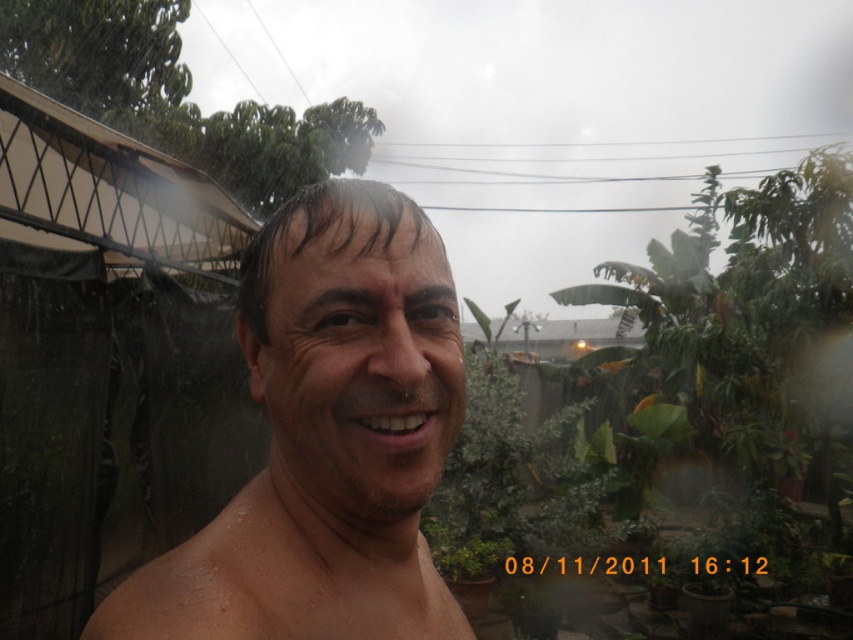
Does wet skin face at center appear on the left side of green leafy plant at center?

Yes, wet skin face at center is to the left of green leafy plant at center.

Who is more distant from viewer, (122, 628) or (717, 205)?

The point (717, 205) is behind.

Where is `wet skin face at center`? wet skin face at center is located at coordinates (326, 438).